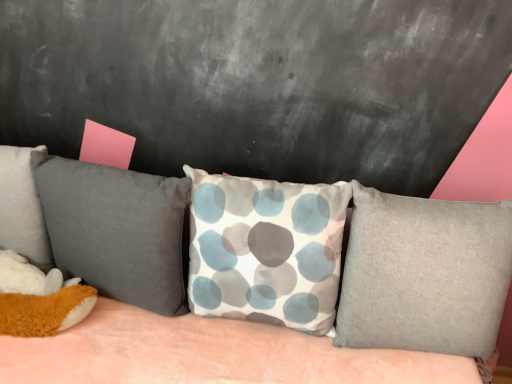
Question: From their relative heights in the image, would you say textured fabric couch at center is taller or shorter than velvety gray pillow at left, which appears as the third pillow when viewed from the right?

Choices:
 (A) tall
 (B) short

Answer: (A)

Question: Visually, is textured fabric couch at center positioned to the left or to the right of velvety gray pillow at left, positioned as the second pillow in left-to-right order?

Choices:
 (A) right
 (B) left

Answer: (A)

Question: Which is farther from the velvety gray pillow at left, positioned as the second pillow in left-to-right order?

Choices:
 (A) white fabric pillow with blue and gray circles at center, which appears as the 2th pillow when viewed from the right
 (B) gray fabric pillow at center, the 4th pillow when ordered from left to right
 (C) soft gray pillow at left, which is counted as the fourth pillow, starting from the right
 (D) textured fabric couch at center

Answer: (B)

Question: Considering the real-world distances, which object is farthest from the white fabric pillow with blue and gray circles at center, which appears as the 2th pillow when viewed from the right?

Choices:
 (A) gray fabric pillow at center, which is counted as the first pillow, starting from the right
 (B) velvety gray pillow at left, positioned as the second pillow in left-to-right order
 (C) textured fabric couch at center
 (D) soft gray pillow at left, the first pillow in the left-to-right sequence

Answer: (D)